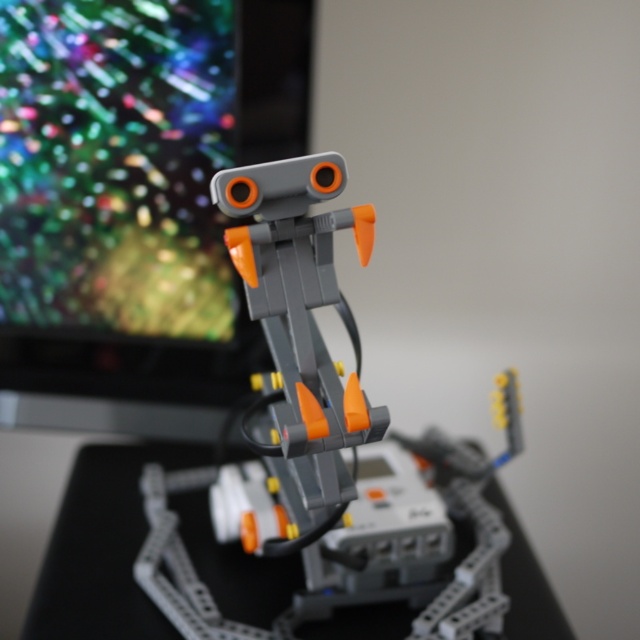
You are an engineer working on a desk. You need to place a monitor directly in front of the matte plastic robot at center. Where should you position the monitor relative to the robot?

The matte plastic robot at center is located at point coordinates of (301, 323). To place the monitor directly in front of it, position the monitor in the same horizontal plane but at a point closer to the front side of the robot, ensuring it faces the robot.

You are trying to determine if the matte plastic robot at center can be placed on the gray plastic table at center without exceeding the table height. Based on the scene description, is this possible?

The matte plastic robot at center is taller than the gray plastic table at center, so placing it on the table would cause the robot to exceed the table height.